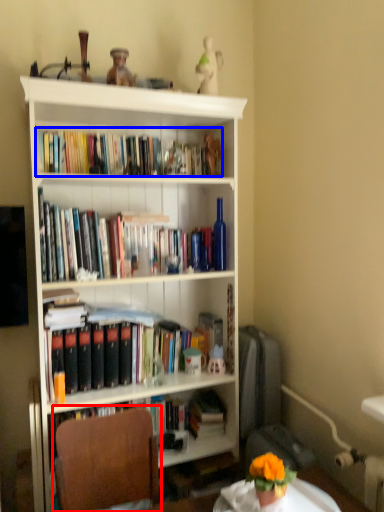
Question: Which point is closer to the camera, chair (highlighted by a red box) or book (highlighted by a blue box)?

Choices:
 (A) chair
 (B) book

Answer: (A)